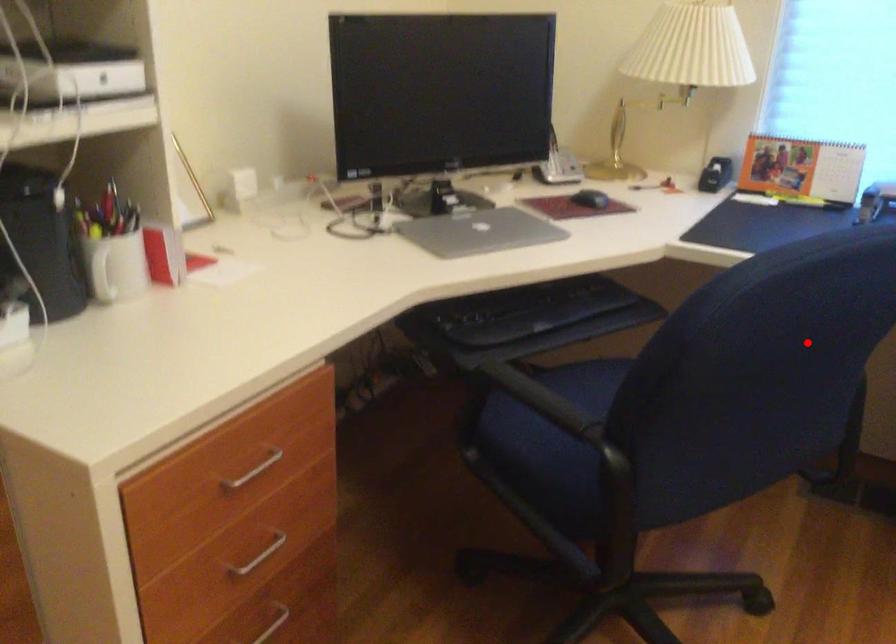
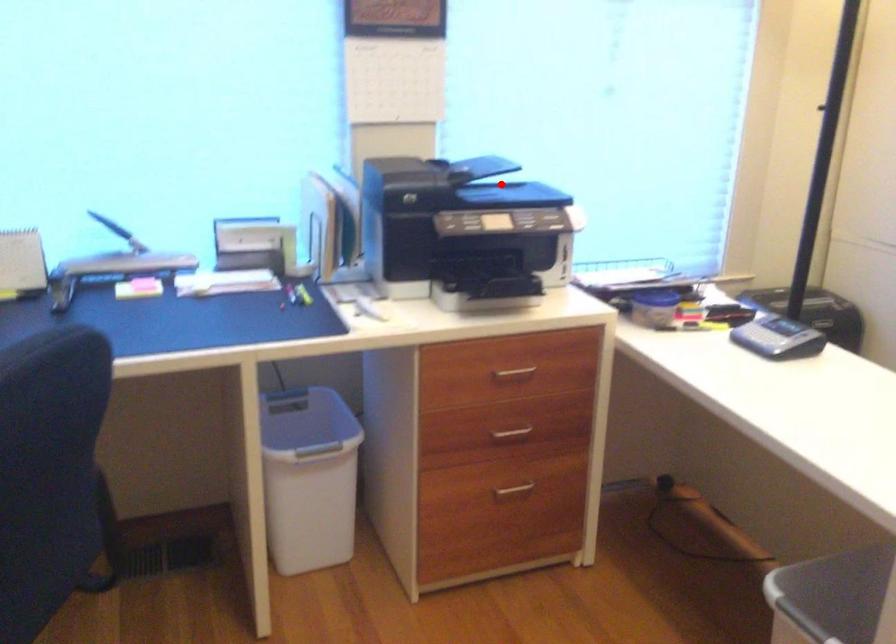
I am providing you with two images of the same scene from different viewpoints. A red point is marked on the first image and another point is marked on the second image. Is the red point in image1 aligned with the point shown in image2?

No